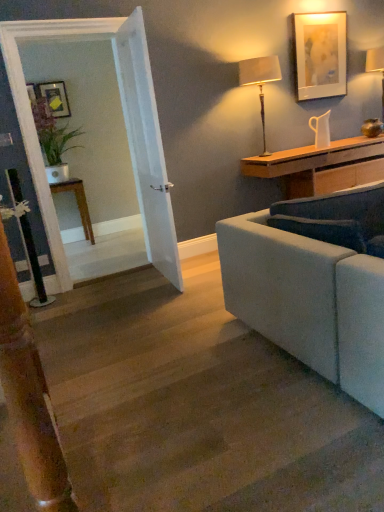
Question: Can you confirm if brown wooden table at left is smaller than white ceramic pitcher at upper right?

Choices:
 (A) no
 (B) yes

Answer: (A)

Question: From the image's perspective, is brown wooden table at left beneath white ceramic pitcher at upper right?

Choices:
 (A) no
 (B) yes

Answer: (B)

Question: Does brown wooden table at left have a larger size compared to white ceramic pitcher at upper right?

Choices:
 (A) yes
 (B) no

Answer: (A)

Question: Can you confirm if brown wooden table at left is positioned to the left of white ceramic pitcher at upper right?

Choices:
 (A) yes
 (B) no

Answer: (A)

Question: From a real-world perspective, is brown wooden table at left on top of white ceramic pitcher at upper right?

Choices:
 (A) yes
 (B) no

Answer: (B)

Question: In terms of height, does wooden desk at right look taller or shorter compared to matte white picture frame at upper right, which is the 1th picture frame in right-to-left order?

Choices:
 (A) tall
 (B) short

Answer: (B)

Question: Is wooden desk at right situated inside matte white picture frame at upper right, which is the 2th picture frame from left to right, or outside?

Choices:
 (A) inside
 (B) outside

Answer: (B)

Question: From a real-world perspective, is wooden desk at right positioned above or below matte white picture frame at upper right, which is the 2th picture frame from left to right?

Choices:
 (A) above
 (B) below

Answer: (B)

Question: From the image's perspective, is wooden desk at right located above or below matte white picture frame at upper right, arranged as the 1th picture frame when viewed from the front?

Choices:
 (A) below
 (B) above

Answer: (A)

Question: Is wooden stairs at lower left in front of or behind white ceramic pitcher at upper right in the image?

Choices:
 (A) front
 (B) behind

Answer: (A)

Question: Do you think wooden stairs at lower left is within white ceramic pitcher at upper right, or outside of it?

Choices:
 (A) outside
 (B) inside

Answer: (A)

Question: In terms of height, does wooden stairs at lower left look taller or shorter compared to white ceramic pitcher at upper right?

Choices:
 (A) short
 (B) tall

Answer: (A)

Question: Is wooden stairs at lower left bigger or smaller than white ceramic pitcher at upper right?

Choices:
 (A) big
 (B) small

Answer: (A)

Question: Looking at their shapes, would you say wooden desk at right is wider or thinner than matte beige lampshade at upper right, the 1th lamp viewed from the left?

Choices:
 (A) wide
 (B) thin

Answer: (A)

Question: From a real-world perspective, is wooden desk at right above or below matte beige lampshade at upper right, which ranks as the 1th lamp in front-to-back order?

Choices:
 (A) above
 (B) below

Answer: (B)